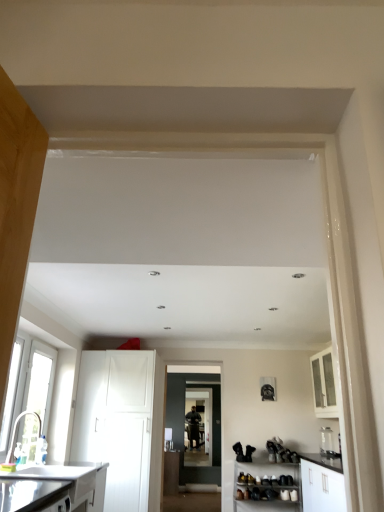
Measure the distance between point (317, 406) and camera.

5.94 meters.

Image resolution: width=384 pixels, height=512 pixels. Identify the location of white glossy countertop at lower left. (30, 494).

From the image's perspective, between brushed metal sink at lower left and matte black door at center, who is located below?

matte black door at center.

Between brushed metal sink at lower left and matte black door at center, which one appears on the left side from the viewer's perspective?

Positioned to the left is brushed metal sink at lower left.

Is brushed metal sink at lower left shorter than matte black door at center?

Yes, brushed metal sink at lower left is shorter than matte black door at center.

Looking at the image, does brushed metal sink at lower left seem bigger or smaller compared to matte black door at center?

Clearly, brushed metal sink at lower left is smaller in size than matte black door at center.

Is white glass cabinet at right, the first cabinetry when ordered from right to left, positioned beyond the bounds of clear glass window at left, marked as the 2th window in a back-to-front arrangement?

Yes, white glass cabinet at right, the first cabinetry when ordered from right to left, is located beyond the bounds of clear glass window at left, marked as the 2th window in a back-to-front arrangement.

Does white glass cabinet at right, the 3th cabinetry in the back-to-front sequence, have a smaller size compared to clear glass window at left, marked as the 2th window in a back-to-front arrangement?

No, white glass cabinet at right, the 3th cabinetry in the back-to-front sequence, is not smaller than clear glass window at left, marked as the 2th window in a back-to-front arrangement.

Is white glass cabinet at right, the 3th cabinetry in the back-to-front sequence, turned away from clear glass window at left, the 1th window from the front?

No, white glass cabinet at right, the 3th cabinetry in the back-to-front sequence, is not facing away from clear glass window at left, the 1th window from the front.

Find the location of a particular element. window that is the 2nd object located above the white glass cabinet at right, arranged as the 5th cabinetry when viewed from the left (from the image's perspective) is located at coordinates (11, 393).

Considering the sizes of brushed metal sink at lower left and white matte shoe rack at lower right, the 4th cabinetry positioned from the front, in the image, is brushed metal sink at lower left bigger or smaller than white matte shoe rack at lower right, the 4th cabinetry positioned from the front,?

Clearly, brushed metal sink at lower left is smaller in size than white matte shoe rack at lower right, the 4th cabinetry positioned from the front.

Is brushed metal sink at lower left oriented away from white matte shoe rack at lower right, marked as the second cabinetry in a right-to-left arrangement?

No, brushed metal sink at lower left's orientation is not away from white matte shoe rack at lower right, marked as the second cabinetry in a right-to-left arrangement.

Can you confirm if brushed metal sink at lower left is positioned to the right of white matte shoe rack at lower right, marked as the second cabinetry in a right-to-left arrangement?

No, brushed metal sink at lower left is not to the right of white matte shoe rack at lower right, marked as the second cabinetry in a right-to-left arrangement.

Is brushed metal sink at lower left next to white matte shoe rack at lower right, positioned as the 4th cabinetry in left-to-right order?

brushed metal sink at lower left and white matte shoe rack at lower right, positioned as the 4th cabinetry in left-to-right order, are not in contact.

In terms of width, does white plastic window at left, which appears as the first window when viewed from the back, look wider or thinner when compared to white matte cabinet at center, marked as the 1th cabinetry in a back-to-front arrangement?

white plastic window at left, which appears as the first window when viewed from the back, is thinner than white matte cabinet at center, marked as the 1th cabinetry in a back-to-front arrangement.

From the image's perspective, between white plastic window at left, which appears as the first window when viewed from the back, and white matte cabinet at center, marked as the 1th cabinetry in a back-to-front arrangement, who is located below?

white matte cabinet at center, marked as the 1th cabinetry in a back-to-front arrangement, appears lower in the image.

Considering the relative sizes of white plastic window at left, which appears as the first window when viewed from the back, and white matte cabinet at center, which is the third cabinetry from right to left, in the image provided, is white plastic window at left, which appears as the first window when viewed from the back, taller than white matte cabinet at center, which is the third cabinetry from right to left,?

Yes.

Which is more to the right, white plastic window at left, which appears as the first window when viewed from the back, or white matte cabinet at center, which is the third cabinetry from right to left?

Positioned to the right is white matte cabinet at center, which is the third cabinetry from right to left.

Is point (74, 495) positioned after point (131, 351)?

No.

In the scene shown: Between satin white cabinet at lower left, the fifth cabinetry from the right, and white matte cabinet at left, marked as the fourth cabinetry in a back-to-front arrangement, which one has larger size?

With larger size is white matte cabinet at left, marked as the fourth cabinetry in a back-to-front arrangement.

How different are the orientations of satin white cabinet at lower left, the fifth cabinetry from the right, and white matte cabinet at left, acting as the second cabinetry starting from the left, in degrees?

The angle between the facing direction of satin white cabinet at lower left, the fifth cabinetry from the right, and the facing direction of white matte cabinet at left, acting as the second cabinetry starting from the left, is 92.4 degrees.

Is satin white cabinet at lower left, the fifth cabinetry from the right, spatially inside white matte cabinet at left, marked as the fourth cabinetry in a back-to-front arrangement, or outside of it?

satin white cabinet at lower left, the fifth cabinetry from the right, is located beyond the bounds of white matte cabinet at left, marked as the fourth cabinetry in a back-to-front arrangement.

Is white glass cabinet at right, the first cabinetry when ordered from right to left, next to transparent glass door at center and touching it?

No, white glass cabinet at right, the first cabinetry when ordered from right to left, is not with transparent glass door at center.

From a real-world perspective, is white glass cabinet at right, the 3th cabinetry in the back-to-front sequence, physically above transparent glass door at center?

Yes, from a real-world perspective, white glass cabinet at right, the 3th cabinetry in the back-to-front sequence, is over transparent glass door at center

Does white glass cabinet at right, arranged as the 5th cabinetry when viewed from the left, have a greater width compared to transparent glass door at center?

Correct, the width of white glass cabinet at right, arranged as the 5th cabinetry when viewed from the left, exceeds that of transparent glass door at center.

Is point (327, 362) in front of point (205, 455)?

Yes.

From a real-world perspective, which is physically below, white matte cabinet at center, the third cabinetry viewed from the left, or clear glass jar at lower right?

white matte cabinet at center, the third cabinetry viewed from the left, is physically lower.

Is white matte cabinet at center, marked as the 1th cabinetry in a back-to-front arrangement, not within clear glass jar at lower right?

Yes, white matte cabinet at center, marked as the 1th cabinetry in a back-to-front arrangement, is not within clear glass jar at lower right.

Which point is more distant from viewer, (165, 458) or (332, 433)?

Positioned behind is point (165, 458).

Which of these two, white matte cabinet at center, the third cabinetry viewed from the left, or clear glass jar at lower right, stands taller?

white matte cabinet at center, the third cabinetry viewed from the left.

Image resolution: width=384 pixels, height=512 pixels. I want to click on door beneath the brushed metal sink at lower left (from a real-world perspective), so click(184, 426).

Locate an element on the screen. Image resolution: width=384 pixels, height=512 pixels. the 1st cabinetry below the clear glass window at left, marked as the 2th window in a back-to-front arrangement (from the image's perspective) is located at coordinates (324, 384).

When comparing their distances from white matte shoe rack at lower right, positioned as the 4th cabinetry in left-to-right order, does clear glass window at left, marked as the 2th window in a back-to-front arrangement, or satin white cabinet at lower left, the 1th cabinetry from the left, seem further?

clear glass window at left, marked as the 2th window in a back-to-front arrangement, lies further to white matte shoe rack at lower right, positioned as the 4th cabinetry in left-to-right order, than the other object.

From the image, which object appears to be nearer to white glass cabinet at right, the 3th cabinetry in the front-to-back sequence, white matte shoe rack at lower right, positioned as the 4th cabinetry in left-to-right order, or white matte cabinet at center, marked as the 1th cabinetry in a back-to-front arrangement?

Among the two, white matte shoe rack at lower right, positioned as the 4th cabinetry in left-to-right order, is located nearer to white glass cabinet at right, the 3th cabinetry in the front-to-back sequence.

Looking at the image, which one is located further to transparent glass door at center, clear glass jar at lower right or white matte shoe rack at lower right, which is counted as the 2th cabinetry, starting from the back?

The object further to transparent glass door at center is clear glass jar at lower right.

Which object lies further to the anchor point brushed metal sink at lower left, white matte shoe rack at lower right, the 4th cabinetry positioned from the front, or clear glass window at left, the 1th window from the front?

white matte shoe rack at lower right, the 4th cabinetry positioned from the front, is further to brushed metal sink at lower left.

Considering their positions, is white plastic window at left, which appears as the first window when viewed from the back, positioned closer to white matte cabinet at left, acting as the second cabinetry starting from the left, than white matte cabinet at center, which is the third cabinetry from right to left?

white plastic window at left, which appears as the first window when viewed from the back, is closer to white matte cabinet at left, acting as the second cabinetry starting from the left.

Considering their positions, is white matte shoe rack at lower right, the 4th cabinetry positioned from the front, positioned closer to clear glass window at left, marked as the 2th window in a back-to-front arrangement, than white glossy countertop at lower left?

Among the two, white glossy countertop at lower left is located nearer to clear glass window at left, marked as the 2th window in a back-to-front arrangement.

Looking at this image, from the image, which object appears to be farther from clear glass jar at lower right, transparent glass door at center or matte black door at center?

matte black door at center.

When comparing their distances from brushed metal sink at lower left, does transparent glass door at center or white matte cabinet at left, the 2th cabinetry in the front-to-back sequence, seem closer?

Among the two, white matte cabinet at left, the 2th cabinetry in the front-to-back sequence, is located nearer to brushed metal sink at lower left.

Identify the location of appliance positioned between brushed metal sink at lower left and transparent glass door at center from near to far. The width and height of the screenshot is (384, 512). (326, 441).

This screenshot has height=512, width=384. What are the coordinates of `door between white glossy countertop at lower left and white matte cabinet at center, marked as the 1th cabinetry in a back-to-front arrangement, along the z-axis` in the screenshot? It's located at (184, 426).

Identify the location of appliance between clear glass window at left, marked as the 2th window in a back-to-front arrangement, and white glass cabinet at right, the 3th cabinetry in the front-to-back sequence. (326, 441).

Find the location of `appliance between white glass cabinet at right, the 3th cabinetry in the back-to-front sequence, and white matte cabinet at center, marked as the 1th cabinetry in a back-to-front arrangement, in the front-back direction`. appliance between white glass cabinet at right, the 3th cabinetry in the back-to-front sequence, and white matte cabinet at center, marked as the 1th cabinetry in a back-to-front arrangement, in the front-back direction is located at coordinates (326, 441).